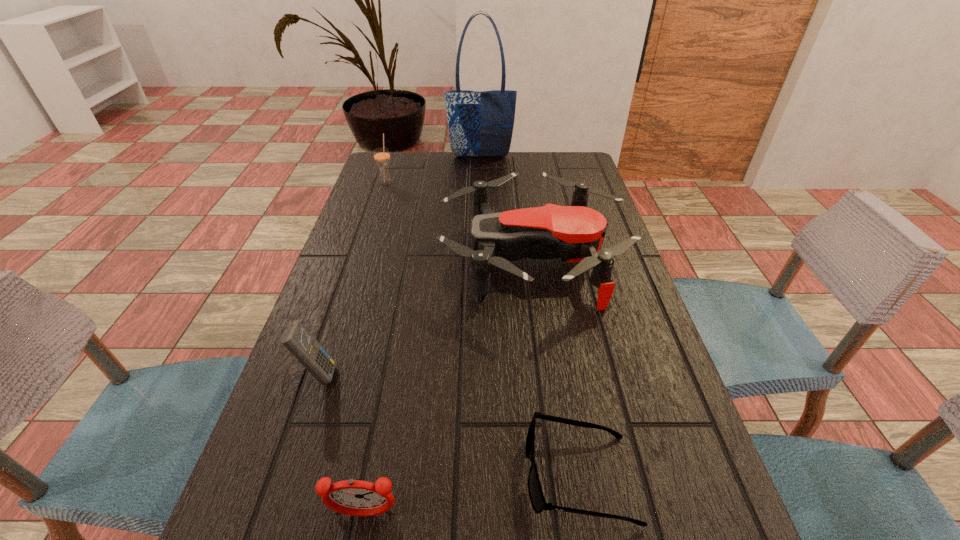
Where is `vacant space located on the camera side of the drone`? The image size is (960, 540). vacant space located on the camera side of the drone is located at coordinates (377, 260).

Locate an element on the screen. The height and width of the screenshot is (540, 960). vacant space located on the camera side of the drone is located at coordinates (389, 260).

Identify the location of vacant space located 0.090m on the front-facing side of the fourth farthest object. The image size is (960, 540). (384, 374).

You are a GUI agent. You are given a task and a screenshot of the screen. Output one action in this format:
    pyautogui.click(x=<x>, y=<y>)
    Task: Click on the vacant position located on the front-facing side of the sunglasses
    
    Given the screenshot: What is the action you would take?
    pyautogui.click(x=489, y=476)

Where is `vacant space situated on the front-facing side of the sunglasses`? The width and height of the screenshot is (960, 540). vacant space situated on the front-facing side of the sunglasses is located at coordinates (494, 476).

This screenshot has width=960, height=540. Find the location of `free space located on the front-facing side of the sunglasses`. free space located on the front-facing side of the sunglasses is located at coordinates (406, 476).

Image resolution: width=960 pixels, height=540 pixels. Find the location of `shopping bag located at the far edge`. shopping bag located at the far edge is located at coordinates (481, 124).

Identify the location of straw located at the far edge. (381, 155).

Identify the location of straw present at the left edge. (381, 155).

Identify the location of calculator present at the left edge. The width and height of the screenshot is (960, 540). (302, 345).